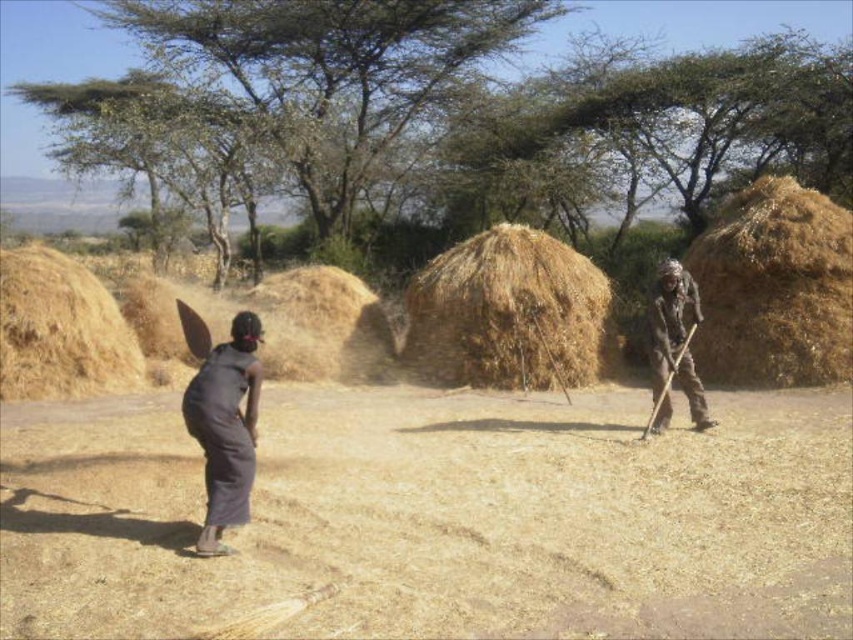
Question: Can you confirm if brown straw stack at center is wider than dark gray fabric at lower left?

Choices:
 (A) yes
 (B) no

Answer: (A)

Question: Among these points, which one is nearest to the camera?

Choices:
 (A) [231, 458]
 (B) [372, 307]

Answer: (A)

Question: Which point is closer to the camera?

Choices:
 (A) brown straw at left
 (B) brown straw stack at center
 (C) dark gray fabric at lower left
 (D) brown straw at center

Answer: (C)

Question: Which point is farther to the camera?

Choices:
 (A) (699, 304)
 (B) (113, 348)
 (C) (334, 276)

Answer: (C)

Question: Is brown straw at center below dark brown fabric at right?

Choices:
 (A) yes
 (B) no

Answer: (B)

Question: Is brown straw stack at right to the right of brown straw stack at center from the viewer's perspective?

Choices:
 (A) yes
 (B) no

Answer: (A)